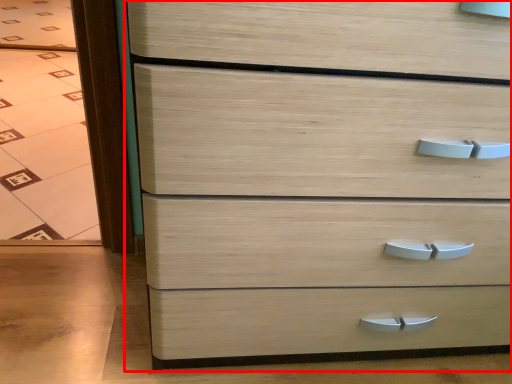
Question: From the image's perspective, where is chest of drawers (annotated by the red box) located relative to glass door?

Choices:
 (A) above
 (B) below

Answer: (B)